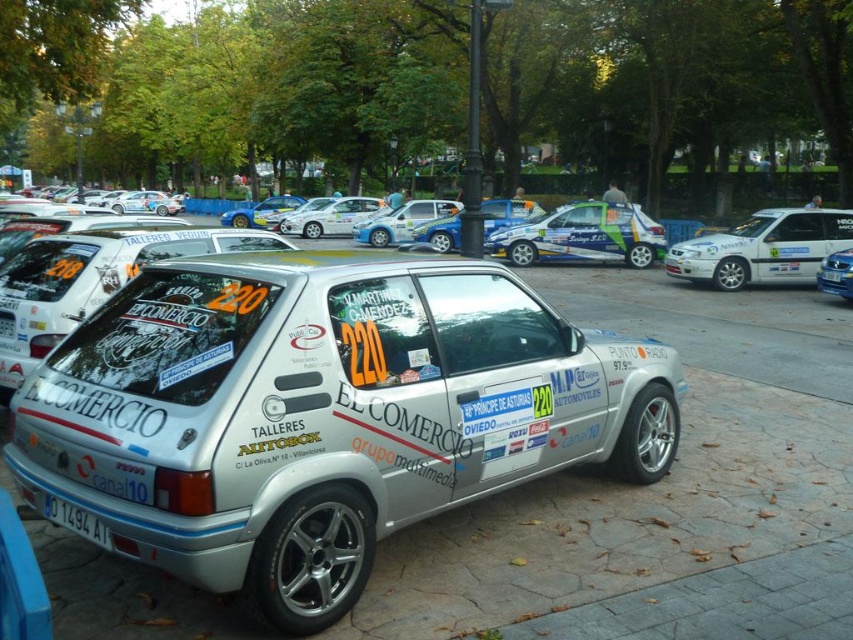
Question: Which point is closer to the camera taking this photo?

Choices:
 (A) pos(532,204)
 (B) pos(840,269)
 (C) pos(271,589)

Answer: (C)

Question: Can you confirm if white glossy car at right is positioned to the right of matte silver hatchback at center?

Choices:
 (A) yes
 (B) no

Answer: (A)

Question: Which of these objects is positioned farthest from the metallic blue hatchback at center?

Choices:
 (A) white plastic license plate at lower left
 (B) white glossy car at right

Answer: (A)

Question: Which object appears farthest from the camera in this image?

Choices:
 (A) matte silver hatchback at center
 (B) white glossy hatchback at center
 (C) white metallic car at center
 (D) white glossy car at center

Answer: (A)

Question: Is white metallic car at center below white glossy car at center?

Choices:
 (A) no
 (B) yes

Answer: (B)

Question: Can you confirm if white metallic car at center is positioned above white plastic license plate at lower left?

Choices:
 (A) no
 (B) yes

Answer: (B)